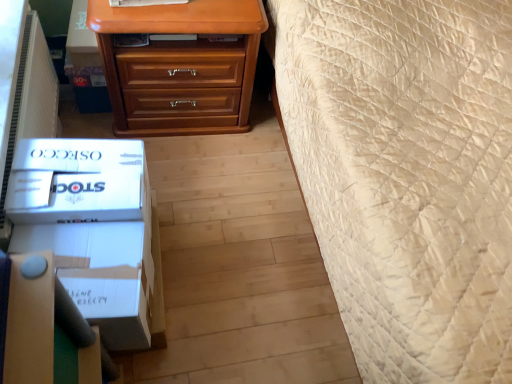
Describe the element at coordinates (180, 66) in the screenshot. The width and height of the screenshot is (512, 384). I see `matte wood chest of drawers at upper center` at that location.

At what (x,y) coordinates should I click in order to perform the action: click on white cardboard box at lower left, positioned as the 2th box in top-to-bottom order. Please return your answer as a coordinate pair (x, y). Image resolution: width=512 pixels, height=384 pixels. Looking at the image, I should click on (94, 230).

What do you see at coordinates (76, 181) in the screenshot? I see `white cardboard box at lower left, which is counted as the 2th box, starting from the bottom` at bounding box center [76, 181].

The height and width of the screenshot is (384, 512). I want to click on matte wood chest of drawers at upper center, so click(x=180, y=66).

Is white cardboard box at lower left, positioned as the 2th box in top-to-bottom order, oriented towards matte wood chest of drawers at upper center?

No, white cardboard box at lower left, positioned as the 2th box in top-to-bottom order, is not aimed at matte wood chest of drawers at upper center.

Which is more to the left, white cardboard box at lower left, which is the 1th box in bottom-to-top order, or matte wood chest of drawers at upper center?

From the viewer's perspective, white cardboard box at lower left, which is the 1th box in bottom-to-top order, appears more on the left side.

Who is smaller, white cardboard box at lower left, positioned as the 2th box in top-to-bottom order, or matte wood chest of drawers at upper center?

white cardboard box at lower left, positioned as the 2th box in top-to-bottom order, is smaller.

In the scene shown: Is white cardboard box at lower left, which is counted as the 2th box, starting from the bottom, thinner than matte wood chest of drawers at upper center?

Correct, the width of white cardboard box at lower left, which is counted as the 2th box, starting from the bottom, is less than that of matte wood chest of drawers at upper center.

Can you confirm if white cardboard box at lower left, which is counted as the 2th box, starting from the bottom, is taller than matte wood chest of drawers at upper center?

In fact, white cardboard box at lower left, which is counted as the 2th box, starting from the bottom, may be shorter than matte wood chest of drawers at upper center.

Who is more distant, white cardboard box at lower left, which is counted as the 2th box, starting from the bottom, or matte wood chest of drawers at upper center?

Positioned behind is matte wood chest of drawers at upper center.

From a real-world perspective, is white cardboard box at lower left, which is the first box in top-to-bottom order, on matte wood chest of drawers at upper center?

Yes, from a real-world perspective, white cardboard box at lower left, which is the first box in top-to-bottom order, is above matte wood chest of drawers at upper center.

From the image's perspective, is white cardboard box at lower left, which is the 1th box in bottom-to-top order, positioned above or below white cardboard box at lower left, which is counted as the 2th box, starting from the bottom?

white cardboard box at lower left, which is the 1th box in bottom-to-top order, is below white cardboard box at lower left, which is counted as the 2th box, starting from the bottom.

From a real-world perspective, is white cardboard box at lower left, positioned as the 2th box in top-to-bottom order, physically located above or below white cardboard box at lower left, which is counted as the 2th box, starting from the bottom?

Clearly, from a real-world perspective, white cardboard box at lower left, positioned as the 2th box in top-to-bottom order, is below white cardboard box at lower left, which is counted as the 2th box, starting from the bottom.

Is white cardboard box at lower left, which is the 1th box in bottom-to-top order, wider or thinner than white cardboard box at lower left, which is the first box in top-to-bottom order?

In the image, white cardboard box at lower left, which is the 1th box in bottom-to-top order, appears to be wider than white cardboard box at lower left, which is the first box in top-to-bottom order.

Is white cardboard box at lower left, positioned as the 2th box in top-to-bottom order, facing away from white cardboard box at lower left, which is counted as the 2th box, starting from the bottom?

No, white cardboard box at lower left, positioned as the 2th box in top-to-bottom order, is not facing away from white cardboard box at lower left, which is counted as the 2th box, starting from the bottom.

Is white cardboard box at lower left, which is counted as the 2th box, starting from the bottom, turned away from white cardboard box at lower left, which is the 1th box in bottom-to-top order?

No.

Considering the relative sizes of white cardboard box at lower left, which is counted as the 2th box, starting from the bottom, and white cardboard box at lower left, positioned as the 2th box in top-to-bottom order, in the image provided, is white cardboard box at lower left, which is counted as the 2th box, starting from the bottom, thinner than white cardboard box at lower left, positioned as the 2th box in top-to-bottom order,?

Yes, white cardboard box at lower left, which is counted as the 2th box, starting from the bottom, is thinner than white cardboard box at lower left, positioned as the 2th box in top-to-bottom order.

Is white cardboard box at lower left, which is counted as the 2th box, starting from the bottom, located outside white cardboard box at lower left, which is the 1th box in bottom-to-top order?

Yes, white cardboard box at lower left, which is counted as the 2th box, starting from the bottom, is located beyond the bounds of white cardboard box at lower left, which is the 1th box in bottom-to-top order.

Between white cardboard box at lower left, which is counted as the 2th box, starting from the bottom, and white cardboard box at lower left, positioned as the 2th box in top-to-bottom order, which one appears on the left side from the viewer's perspective?

white cardboard box at lower left, which is counted as the 2th box, starting from the bottom.

Could you tell me if matte wood chest of drawers at upper center is facing white cardboard box at lower left, positioned as the 2th box in top-to-bottom order?

Yes, matte wood chest of drawers at upper center is aimed at white cardboard box at lower left, positioned as the 2th box in top-to-bottom order.

How much distance is there between matte wood chest of drawers at upper center and white cardboard box at lower left, positioned as the 2th box in top-to-bottom order?

25.02 inches.

Which is in front, point (249, 41) or point (139, 226)?

The point (139, 226) is closer to the camera.

How many degrees apart are the facing directions of matte wood chest of drawers at upper center and white cardboard box at lower left, positioned as the 2th box in top-to-bottom order?

The angle between the facing direction of matte wood chest of drawers at upper center and the facing direction of white cardboard box at lower left, positioned as the 2th box in top-to-bottom order, is 86.8 degrees.

In the scene shown: Considering the relative sizes of matte wood chest of drawers at upper center and white cardboard box at lower left, which is counted as the 2th box, starting from the bottom, in the image provided, is matte wood chest of drawers at upper center taller than white cardboard box at lower left, which is counted as the 2th box, starting from the bottom,?

Yes, matte wood chest of drawers at upper center is taller than white cardboard box at lower left, which is counted as the 2th box, starting from the bottom.

Which is behind, matte wood chest of drawers at upper center or white cardboard box at lower left, which is counted as the 2th box, starting from the bottom?

matte wood chest of drawers at upper center is further from the camera.

Is point (233, 102) positioned before point (87, 182)?

No, (233, 102) is further to viewer.

From the matte wood chest of drawers at upper center, count 1st boxs forward and point to it. Please provide its 2D coordinates.

[(76, 181)]

There is a matte wood chest of drawers at upper center. What are the coordinates of `the 2nd box below it (from the image's perspective)` in the screenshot? It's located at (94, 230).

This screenshot has height=384, width=512. I want to click on chest of drawers on the right of white cardboard box at lower left, which is counted as the 2th box, starting from the bottom, so click(180, 66).

Estimate the real-world distances between objects in this image. Which object is closer to white cardboard box at lower left, which is the 1th box in bottom-to-top order, white cardboard box at lower left, which is counted as the 2th box, starting from the bottom, or matte wood chest of drawers at upper center?

white cardboard box at lower left, which is counted as the 2th box, starting from the bottom, lies closer to white cardboard box at lower left, which is the 1th box in bottom-to-top order, than the other object.

Which object lies nearer to the anchor point white cardboard box at lower left, which is the first box in top-to-bottom order, white cardboard box at lower left, positioned as the 2th box in top-to-bottom order, or matte wood chest of drawers at upper center?

The object closer to white cardboard box at lower left, which is the first box in top-to-bottom order, is white cardboard box at lower left, positioned as the 2th box in top-to-bottom order.

Considering their positions, is matte wood chest of drawers at upper center positioned further to white cardboard box at lower left, which is the first box in top-to-bottom order, than white cardboard box at lower left, positioned as the 2th box in top-to-bottom order?

matte wood chest of drawers at upper center is positioned further to the anchor white cardboard box at lower left, which is the first box in top-to-bottom order.

From the image, which object appears to be nearer to matte wood chest of drawers at upper center, white cardboard box at lower left, positioned as the 2th box in top-to-bottom order, or white cardboard box at lower left, which is counted as the 2th box, starting from the bottom?

Among the two, white cardboard box at lower left, which is counted as the 2th box, starting from the bottom, is located nearer to matte wood chest of drawers at upper center.

From the image, which object appears to be farther from white cardboard box at lower left, which is the 1th box in bottom-to-top order, matte wood chest of drawers at upper center or white cardboard box at lower left, which is counted as the 2th box, starting from the bottom?

matte wood chest of drawers at upper center.

Considering their positions, is white cardboard box at lower left, which is the first box in top-to-bottom order, positioned closer to matte wood chest of drawers at upper center than white cardboard box at lower left, which is the 1th box in bottom-to-top order?

white cardboard box at lower left, which is the first box in top-to-bottom order, is closer to matte wood chest of drawers at upper center.

Where is `box that lies between matte wood chest of drawers at upper center and white cardboard box at lower left, which is the 1th box in bottom-to-top order, from top to bottom`? The height and width of the screenshot is (384, 512). box that lies between matte wood chest of drawers at upper center and white cardboard box at lower left, which is the 1th box in bottom-to-top order, from top to bottom is located at coordinates (76, 181).